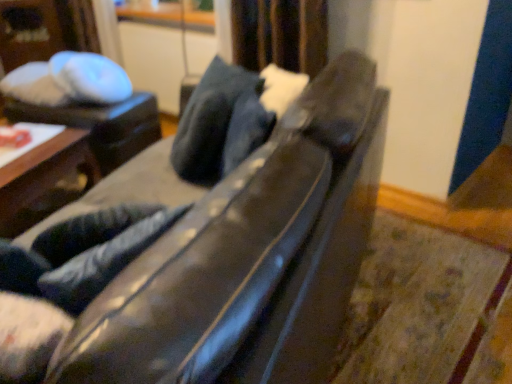
Question: Does satin dark blue curtain at upper center have a lesser width compared to wooden table at left, which is counted as the second table, starting from the back?

Choices:
 (A) yes
 (B) no

Answer: (A)

Question: Is wooden table at left, which is counted as the first table, starting from the front, surrounded by satin dark blue curtain at upper center?

Choices:
 (A) no
 (B) yes

Answer: (A)

Question: Is the depth of satin dark blue curtain at upper center greater than that of wooden table at left, which is counted as the second table, starting from the back?

Choices:
 (A) no
 (B) yes

Answer: (B)

Question: From the image's perspective, is satin dark blue curtain at upper center beneath wooden table at left, which is counted as the first table, starting from the front?

Choices:
 (A) yes
 (B) no

Answer: (B)

Question: From a real-world perspective, is satin dark blue curtain at upper center beneath wooden table at left, which is counted as the second table, starting from the back?

Choices:
 (A) no
 (B) yes

Answer: (A)

Question: Relative to wooden table at left, which is counted as the first table, starting from the front, is dark blue leather pillow at center in front or behind?

Choices:
 (A) front
 (B) behind

Answer: (A)

Question: Is point (249, 74) positioned closer to the camera than point (20, 215)?

Choices:
 (A) closer
 (B) farther

Answer: (A)

Question: Is dark blue leather pillow at center situated inside wooden table at left, which is counted as the second table, starting from the back, or outside?

Choices:
 (A) outside
 (B) inside

Answer: (A)

Question: From the image's perspective, is dark blue leather pillow at center above or below wooden table at left, which is counted as the second table, starting from the back?

Choices:
 (A) below
 (B) above

Answer: (B)

Question: Is white glossy table at upper left, which ranks as the 2th table in front-to-back order, wider or thinner than wooden table at left, which is counted as the first table, starting from the front?

Choices:
 (A) wide
 (B) thin

Answer: (B)

Question: Is white glossy table at upper left, which ranks as the 2th table in front-to-back order, in front of or behind wooden table at left, which is counted as the first table, starting from the front, in the image?

Choices:
 (A) behind
 (B) front

Answer: (A)

Question: Is white glossy table at upper left, the 1th table in the back-to-front sequence, spatially inside wooden table at left, which is counted as the first table, starting from the front, or outside of it?

Choices:
 (A) outside
 (B) inside

Answer: (A)

Question: Is point (53, 117) closer or farther from the camera than point (51, 193)?

Choices:
 (A) closer
 (B) farther

Answer: (B)

Question: Is white glossy table at upper left, the 1th table in the back-to-front sequence, to the left or to the right of dark blue leather pillow at center in the image?

Choices:
 (A) right
 (B) left

Answer: (B)

Question: In terms of width, does white glossy table at upper left, the 1th table in the back-to-front sequence, look wider or thinner when compared to dark blue leather pillow at center?

Choices:
 (A) thin
 (B) wide

Answer: (B)